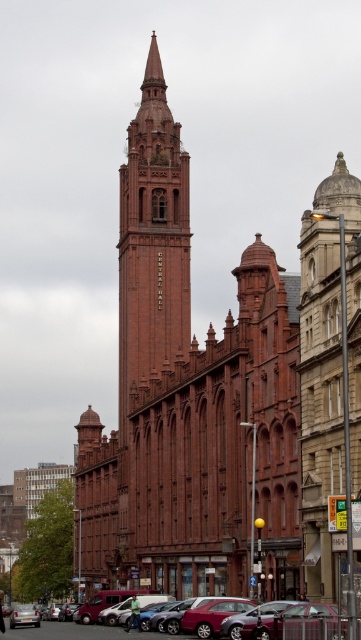
You are standing in front of the grand historic building and notice a metallic silver car parked nearby. Based on the scene description, can you determine the relative positioning of the red brick church at center and the metallic silver car at lower center?

The red brick church at center is positioned on the right side of the metallic silver car at lower center.

You are standing in front of the grand historic building and want to locate the point at coordinates point (189,401). Based on the scene description, where exactly on the building would this point be located?

The point (189,401) is on the red brick church at center.